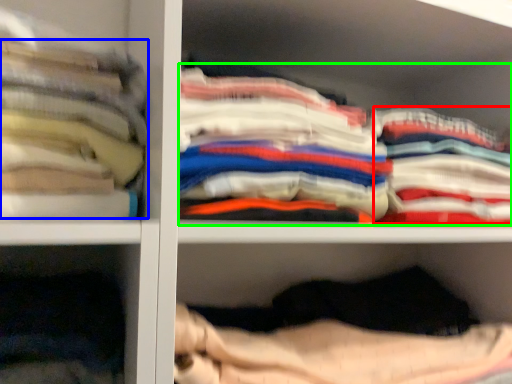
Question: Considering the real-world distances, which object is farthest from clothing (highlighted by a red box)? clothing (highlighted by a blue box) or clothing (highlighted by a green box)?

Choices:
 (A) clothing
 (B) clothing

Answer: (A)